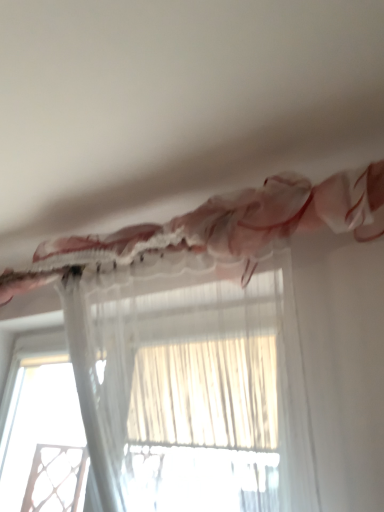
This screenshot has width=384, height=512. What do you see at coordinates (219, 230) in the screenshot?
I see `translucent sheer curtain at upper center, the 1th curtain viewed from the top` at bounding box center [219, 230].

What do you see at coordinates (44, 432) in the screenshot?
I see `transparent fabric at lower left` at bounding box center [44, 432].

I want to click on translucent sheer curtain at upper center, the 1th curtain viewed from the top, so click(x=219, y=230).

Can you tell me how much transparent fabric at lower left and translucent sheer curtain at upper center, the second curtain ordered from the bottom, differ in facing direction?

0.000351 degrees separate the facing orientations of transparent fabric at lower left and translucent sheer curtain at upper center, the second curtain ordered from the bottom.

Between point (43, 506) and point (374, 179), which one is positioned in front?

The point (374, 179) is closer.

Considering the positions of objects transparent fabric at lower left and translucent sheer curtain at upper center, the 1th curtain viewed from the top, in the image provided, who is behind, transparent fabric at lower left or translucent sheer curtain at upper center, the 1th curtain viewed from the top,?

transparent fabric at lower left is behind.

Are transparent fabric at lower left and translucent sheer curtain at upper center, the 1th curtain viewed from the top, far apart?

Yes, transparent fabric at lower left and translucent sheer curtain at upper center, the 1th curtain viewed from the top, are located far from each other.

Does transparent fabric at lower left turn towards translucent sheer curtain at upper center, marked as the 1th curtain in a bottom-to-top arrangement?

No, transparent fabric at lower left does not turn towards translucent sheer curtain at upper center, marked as the 1th curtain in a bottom-to-top arrangement.

From the picture: Considering the sizes of objects transparent fabric at lower left and translucent sheer curtain at upper center, marked as the 1th curtain in a bottom-to-top arrangement, in the image provided, who is bigger, transparent fabric at lower left or translucent sheer curtain at upper center, marked as the 1th curtain in a bottom-to-top arrangement,?

translucent sheer curtain at upper center, marked as the 1th curtain in a bottom-to-top arrangement.

Considering the relative sizes of transparent fabric at lower left and translucent sheer curtain at upper center, which is counted as the second curtain, starting from the top, in the image provided, is transparent fabric at lower left taller than translucent sheer curtain at upper center, which is counted as the second curtain, starting from the top,?

No.

Consider the image. Can you tell me how much transparent fabric at lower left and translucent sheer curtain at upper center, which is counted as the second curtain, starting from the top, differ in facing direction?

1.12 degrees.

From the image's perspective, is translucent sheer curtain at upper center, the 1th curtain viewed from the top, positioned above or below transparent fabric at lower left?

translucent sheer curtain at upper center, the 1th curtain viewed from the top, is situated higher than transparent fabric at lower left in the image.

Which object is closer to the camera taking this photo, translucent sheer curtain at upper center, the 1th curtain viewed from the top, or transparent fabric at lower left?

translucent sheer curtain at upper center, the 1th curtain viewed from the top.

Is translucent sheer curtain at upper center, the 1th curtain viewed from the top, bigger or smaller than transparent fabric at lower left?

In the image, translucent sheer curtain at upper center, the 1th curtain viewed from the top, appears to be larger than transparent fabric at lower left.

Is translucent sheer curtain at upper center, which is counted as the second curtain, starting from the top, positioned with its back to transparent fabric at lower left?

No.

Which object is more forward, translucent sheer curtain at upper center, which is counted as the second curtain, starting from the top, or transparent fabric at lower left?

Positioned in front is translucent sheer curtain at upper center, which is counted as the second curtain, starting from the top.

Considering the relative positions of translucent sheer curtain at upper center, marked as the 1th curtain in a bottom-to-top arrangement, and transparent fabric at lower left in the image provided, is translucent sheer curtain at upper center, marked as the 1th curtain in a bottom-to-top arrangement, to the left or to the right of transparent fabric at lower left?

Based on their positions, translucent sheer curtain at upper center, marked as the 1th curtain in a bottom-to-top arrangement, is located to the right of transparent fabric at lower left.

Considering the sizes of translucent sheer curtain at upper center, the 1th curtain viewed from the top, and translucent sheer curtain at upper center, which is counted as the second curtain, starting from the top, in the image, is translucent sheer curtain at upper center, the 1th curtain viewed from the top, bigger or smaller than translucent sheer curtain at upper center, which is counted as the second curtain, starting from the top,?

Clearly, translucent sheer curtain at upper center, the 1th curtain viewed from the top, is larger in size than translucent sheer curtain at upper center, which is counted as the second curtain, starting from the top.

Considering the relative sizes of translucent sheer curtain at upper center, the second curtain ordered from the bottom, and translucent sheer curtain at upper center, marked as the 1th curtain in a bottom-to-top arrangement, in the image provided, is translucent sheer curtain at upper center, the second curtain ordered from the bottom, taller than translucent sheer curtain at upper center, marked as the 1th curtain in a bottom-to-top arrangement,?

No, translucent sheer curtain at upper center, the second curtain ordered from the bottom, is not taller than translucent sheer curtain at upper center, marked as the 1th curtain in a bottom-to-top arrangement.

Would you consider translucent sheer curtain at upper center, the 1th curtain viewed from the top, to be distant from translucent sheer curtain at upper center, which is counted as the second curtain, starting from the top?

They are positioned close to each other.

From the image's perspective, between translucent sheer curtain at upper center, the 1th curtain viewed from the top, and translucent sheer curtain at upper center, which is counted as the second curtain, starting from the top, who is located below?

translucent sheer curtain at upper center, which is counted as the second curtain, starting from the top, appears lower in the image.

Is translucent sheer curtain at upper center, marked as the 1th curtain in a bottom-to-top arrangement, spatially inside translucent sheer curtain at upper center, the 1th curtain viewed from the top, or outside of it?

translucent sheer curtain at upper center, marked as the 1th curtain in a bottom-to-top arrangement, is spatially positioned inside translucent sheer curtain at upper center, the 1th curtain viewed from the top.

From a real-world perspective, between translucent sheer curtain at upper center, which is counted as the second curtain, starting from the top, and translucent sheer curtain at upper center, the second curtain ordered from the bottom, who is vertically lower?

translucent sheer curtain at upper center, which is counted as the second curtain, starting from the top, from a real-world perspective.

Can you confirm if translucent sheer curtain at upper center, marked as the 1th curtain in a bottom-to-top arrangement, is positioned to the left of translucent sheer curtain at upper center, the 1th curtain viewed from the top?

Incorrect, translucent sheer curtain at upper center, marked as the 1th curtain in a bottom-to-top arrangement, is not on the left side of translucent sheer curtain at upper center, the 1th curtain viewed from the top.

From the picture: From the image's perspective, relative to translucent sheer curtain at upper center, the second curtain ordered from the bottom, is translucent sheer curtain at upper center, marked as the 1th curtain in a bottom-to-top arrangement, above or below?

Based on their image positions, translucent sheer curtain at upper center, marked as the 1th curtain in a bottom-to-top arrangement, is located beneath translucent sheer curtain at upper center, the second curtain ordered from the bottom.

From the image's perspective, starting from the transparent fabric at lower left, which curtain is the 2nd one above? Please provide its 2D coordinates.

[(219, 230)]

The image size is (384, 512). In order to click on window directly beneath the translucent sheer curtain at upper center, which is counted as the second curtain, starting from the top (from a real-world perspective) in this screenshot , I will do `click(44, 432)`.

From the image, which object appears to be farther from transparent fabric at lower left, translucent sheer curtain at upper center, the second curtain ordered from the bottom, or translucent sheer curtain at upper center, marked as the 1th curtain in a bottom-to-top arrangement?

The object further to transparent fabric at lower left is translucent sheer curtain at upper center, the second curtain ordered from the bottom.

Looking at the image, which one is located further to translucent sheer curtain at upper center, the 1th curtain viewed from the top, transparent fabric at lower left or translucent sheer curtain at upper center, which is counted as the second curtain, starting from the top?

The object further to translucent sheer curtain at upper center, the 1th curtain viewed from the top, is transparent fabric at lower left.

Looking at the image, which one is located closer to translucent sheer curtain at upper center, the 1th curtain viewed from the top, translucent sheer curtain at upper center, marked as the 1th curtain in a bottom-to-top arrangement, or transparent fabric at lower left?

translucent sheer curtain at upper center, marked as the 1th curtain in a bottom-to-top arrangement, is closer to translucent sheer curtain at upper center, the 1th curtain viewed from the top.

Which object lies nearer to the anchor point translucent sheer curtain at upper center, marked as the 1th curtain in a bottom-to-top arrangement, transparent fabric at lower left or translucent sheer curtain at upper center, the 1th curtain viewed from the top?

translucent sheer curtain at upper center, the 1th curtain viewed from the top, is closer to translucent sheer curtain at upper center, marked as the 1th curtain in a bottom-to-top arrangement.

Which object lies further to the anchor point translucent sheer curtain at upper center, marked as the 1th curtain in a bottom-to-top arrangement, translucent sheer curtain at upper center, the 1th curtain viewed from the top, or transparent fabric at lower left?

Among the two, transparent fabric at lower left is located further to translucent sheer curtain at upper center, marked as the 1th curtain in a bottom-to-top arrangement.

Based on their spatial positions, is translucent sheer curtain at upper center, which is counted as the second curtain, starting from the top, or translucent sheer curtain at upper center, the second curtain ordered from the bottom, closer to transparent fabric at lower left?

The object closer to transparent fabric at lower left is translucent sheer curtain at upper center, which is counted as the second curtain, starting from the top.

I want to click on curtain between translucent sheer curtain at upper center, which is counted as the second curtain, starting from the top, and transparent fabric at lower left from front to back, so click(x=219, y=230).